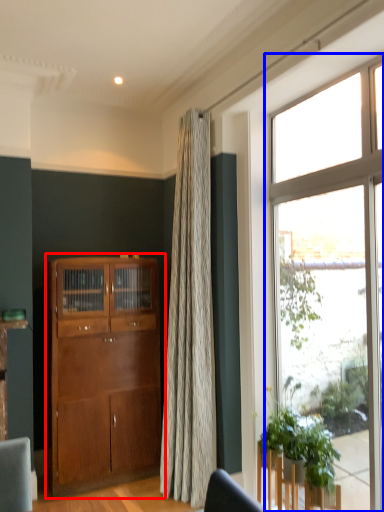
Question: Which of the following is the closest to the observer, cabinetry (highlighted by a red box) or window (highlighted by a blue box)?

Choices:
 (A) cabinetry
 (B) window

Answer: (B)